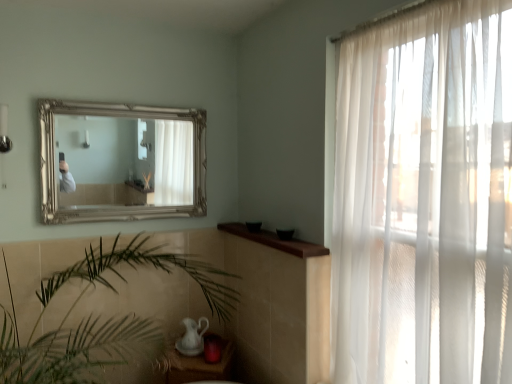
Question: From a real-world perspective, is gold metallic mirror at upper center under sheer white curtain at right?

Choices:
 (A) no
 (B) yes

Answer: (A)

Question: Is gold metallic mirror at upper center taller than sheer white curtain at right?

Choices:
 (A) yes
 (B) no

Answer: (B)

Question: Is gold metallic mirror at upper center wider than sheer white curtain at right?

Choices:
 (A) no
 (B) yes

Answer: (A)

Question: Is gold metallic mirror at upper center to the right of sheer white curtain at right from the viewer's perspective?

Choices:
 (A) no
 (B) yes

Answer: (A)

Question: From a real-world perspective, is gold metallic mirror at upper center positioned over sheer white curtain at right based on gravity?

Choices:
 (A) no
 (B) yes

Answer: (B)

Question: Considering their positions, is sheer white curtain at right located in front of or behind matte white table at lower center?

Choices:
 (A) front
 (B) behind

Answer: (A)

Question: Visually, is sheer white curtain at right positioned to the left or to the right of matte white table at lower center?

Choices:
 (A) left
 (B) right

Answer: (B)

Question: Considering the positions of sheer white curtain at right and matte white table at lower center in the image, is sheer white curtain at right bigger or smaller than matte white table at lower center?

Choices:
 (A) big
 (B) small

Answer: (A)

Question: From the image's perspective, relative to matte white table at lower center, is sheer white curtain at right above or below?

Choices:
 (A) below
 (B) above

Answer: (B)

Question: In the image, is brown wood window sill at center positioned in front of or behind matte white table at lower center?

Choices:
 (A) behind
 (B) front

Answer: (B)

Question: From a real-world perspective, is brown wood window sill at center positioned above or below matte white table at lower center?

Choices:
 (A) below
 (B) above

Answer: (B)

Question: Is brown wood window sill at center situated inside matte white table at lower center or outside?

Choices:
 (A) outside
 (B) inside

Answer: (A)

Question: In terms of size, does brown wood window sill at center appear bigger or smaller than matte white table at lower center?

Choices:
 (A) small
 (B) big

Answer: (A)

Question: In terms of height, does white glossy tea pot at lower center look taller or shorter compared to matte white table at lower center?

Choices:
 (A) short
 (B) tall

Answer: (A)

Question: Visually, is white glossy tea pot at lower center positioned to the left or to the right of matte white table at lower center?

Choices:
 (A) left
 (B) right

Answer: (A)